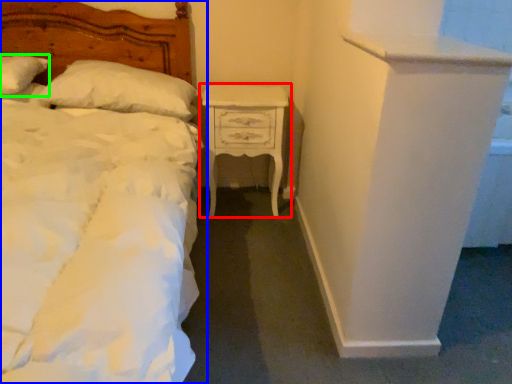
Question: Which is nearer to the nightstand (highlighted by a red box)? bed (highlighted by a blue box) or pillow (highlighted by a green box).

Choices:
 (A) bed
 (B) pillow

Answer: (A)